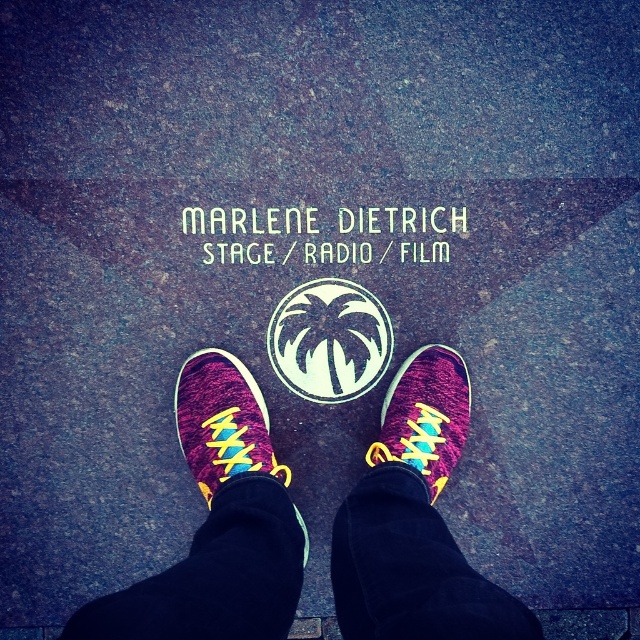
You are standing at the point marked by the coordinates (218,525) in the image. Looking down, what object is directly beneath your feet?

The point at coordinates (218,525) corresponds to knitted sneakers at center, so the object directly beneath your feet is the knitted sneakers at center.

You are standing in front of Marlene Dietrich star on the Hollywood Walk of Fame. You see a point marked at coordinates (221, 420). What object is located at that point?

The point at coordinates (221, 420) corresponds to the knitted suede sneaker at center.